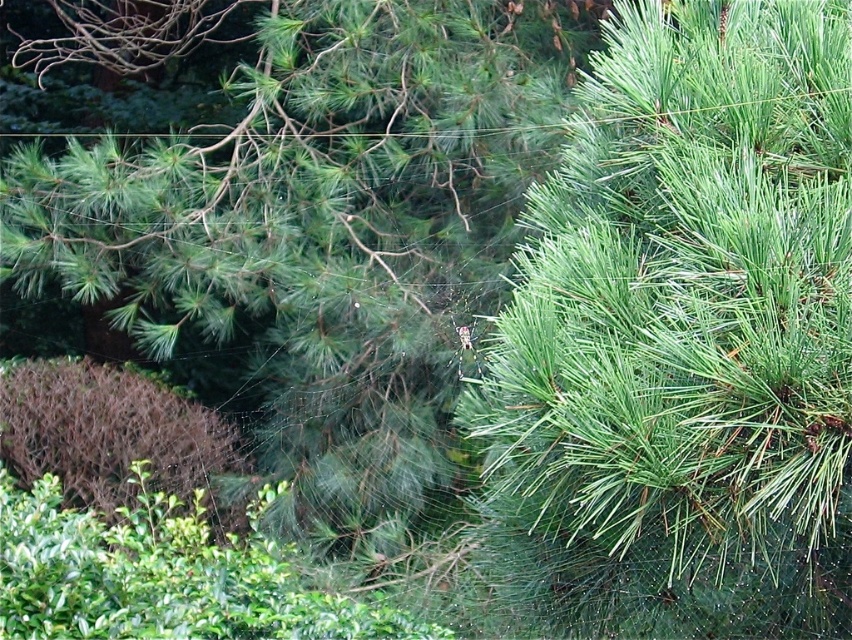
Is green leafy bush at lower left taller than brown textured bush at lower left?

Incorrect, green leafy bush at lower left's height is not larger of brown textured bush at lower left's.

Image resolution: width=852 pixels, height=640 pixels. I want to click on green leafy bush at lower left, so click(160, 577).

Does point (327, 420) come in front of point (1, 516)?

No, (327, 420) is further to viewer.

Measure the distance between green needle-like at center and camera.

A distance of 27.77 feet exists between green needle-like at center and camera.

The image size is (852, 640). I want to click on green needle-like at center, so click(x=325, y=228).

Who is higher up, green needle-like at center or brown textured bush at lower left?

green needle-like at center is above.

Is green needle-like at center to the left of brown textured bush at lower left from the viewer's perspective?

Incorrect, green needle-like at center is not on the left side of brown textured bush at lower left.

Which is in front, point (348, 316) or point (142, 388)?

Point (348, 316) is in front.

I want to click on green needle-like at center, so click(325, 228).